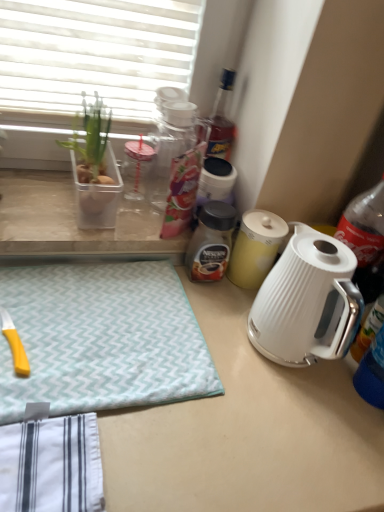
Locate an element on the screen. The image size is (384, 512). space that is in front of brown glass jar at center is located at coordinates (220, 318).